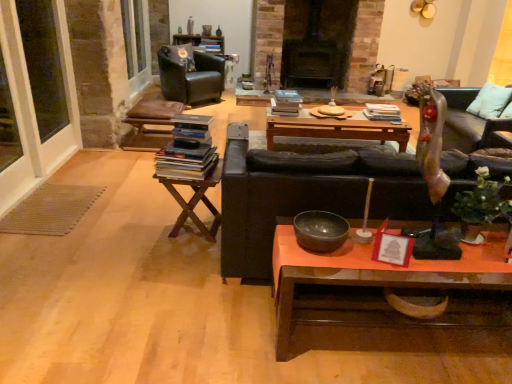
Locate an element on the screen. This screenshot has width=512, height=384. free point below woodenwoodentable at left (from a real-world perspective) is located at coordinates coord(195,234).